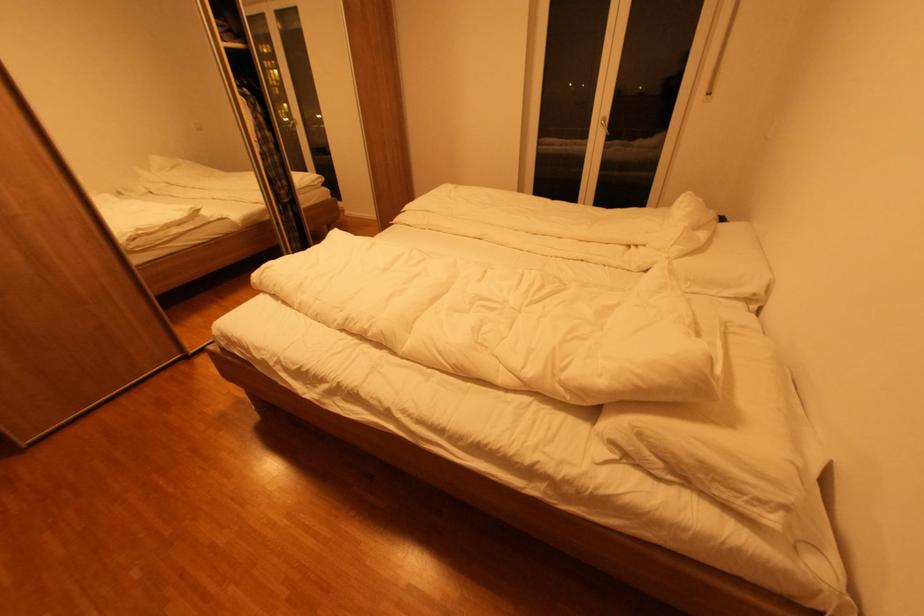
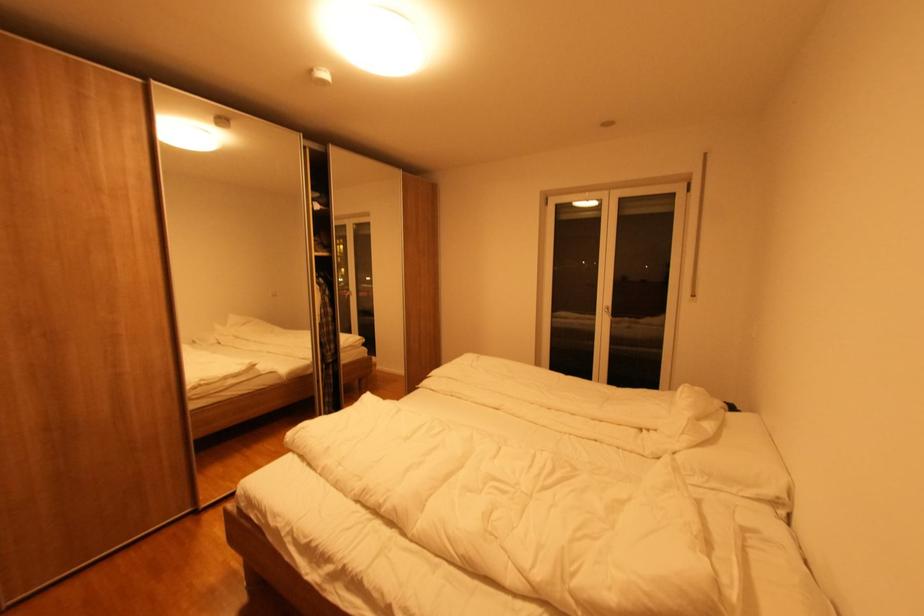
Question: The images are taken continuously from a first-person perspective. In which direction are you moving?

Choices:
 (A) Left
 (B) Right
 (C) Forward
 (D) Backward

Answer: (D)